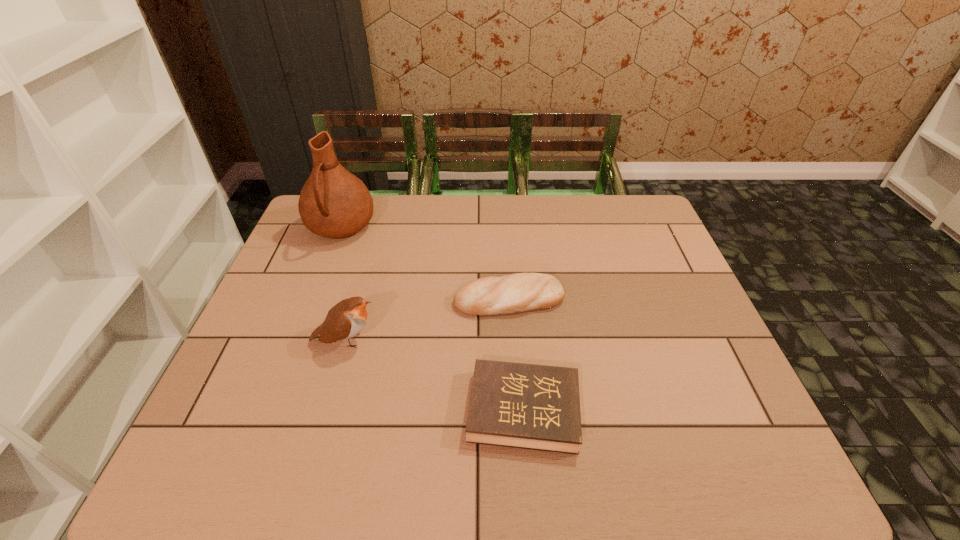
This screenshot has width=960, height=540. I want to click on free point between the second farthest object and the second nearest object, so click(x=427, y=320).

At what (x,y) coordinates should I click in order to perform the action: click on vacant area that lies between the tallest object and the shortest object. Please return your answer as a coordinate pair (x, y). The height and width of the screenshot is (540, 960). Looking at the image, I should click on pyautogui.click(x=432, y=319).

Locate an element on the screen. unoccupied position between the shortest object and the third farthest object is located at coordinates (434, 375).

Image resolution: width=960 pixels, height=540 pixels. Identify the location of object that is the third closest to the third farthest object. (333, 203).

Identify which object is the second closest to the third tallest object. Please provide its 2D coordinates. Your answer should be formatted as a tuple, i.e. [(x, y)], where the tuple contains the x and y coordinates of a point satisfying the conditions above.

[(346, 319)]

You are a GUI agent. You are given a task and a screenshot of the screen. Output one action in this format:
    pyautogui.click(x=<x>, y=<y>)
    Task: Click on the vacant space that satisfies the following two spatial constraints: 1. on the side of the farthest object with the handle; 2. on the right side of the bread
    Image resolution: width=960 pixels, height=540 pixels.
    Given the screenshot: What is the action you would take?
    pyautogui.click(x=314, y=299)

Locate an element on the screen. The image size is (960, 540). blank space that satisfies the following two spatial constraints: 1. at the face of the third shortest object; 2. on the back side of the shortest object is located at coordinates (325, 410).

The width and height of the screenshot is (960, 540). I want to click on vacant region that satisfies the following two spatial constraints: 1. at the face of the second nearest object; 2. on the left side of the shortest object, so click(x=325, y=410).

Identify the location of vacant region that satisfies the following two spatial constraints: 1. on the side of the bread with the handle; 2. on the right side of the farthest object. The width and height of the screenshot is (960, 540). (314, 299).

You are a GUI agent. You are given a task and a screenshot of the screen. Output one action in this format:
    pyautogui.click(x=<x>, y=<y>)
    Task: Click on the free location that satisfies the following two spatial constraints: 1. on the side of the shortest object with the handle; 2. on the right side of the pitcher
    
    Given the screenshot: What is the action you would take?
    pyautogui.click(x=272, y=410)